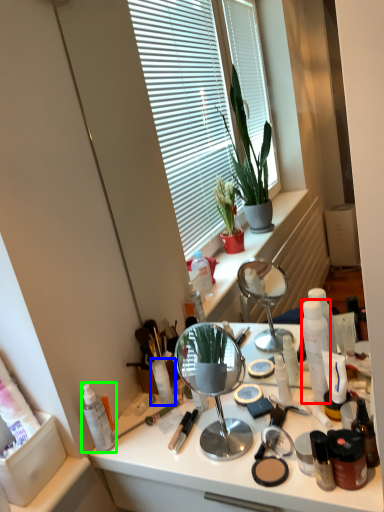
Question: Based on their relative distances, which object is farther from toiletry (highlighted by a red box)? Choose from toiletry (highlighted by a blue box) and toiletry (highlighted by a green box).

Choices:
 (A) toiletry
 (B) toiletry

Answer: (B)